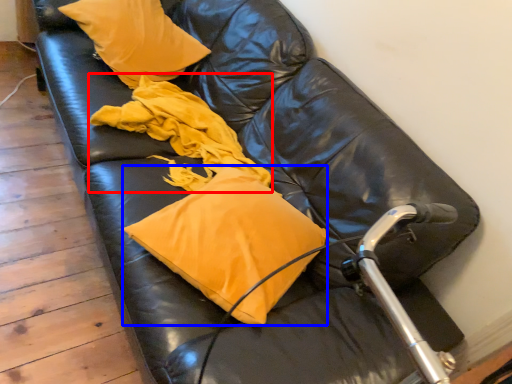
Question: Which object appears closest to the camera in this image, material (highlighted by a red box) or pillow (highlighted by a blue box)?

Choices:
 (A) material
 (B) pillow

Answer: (B)